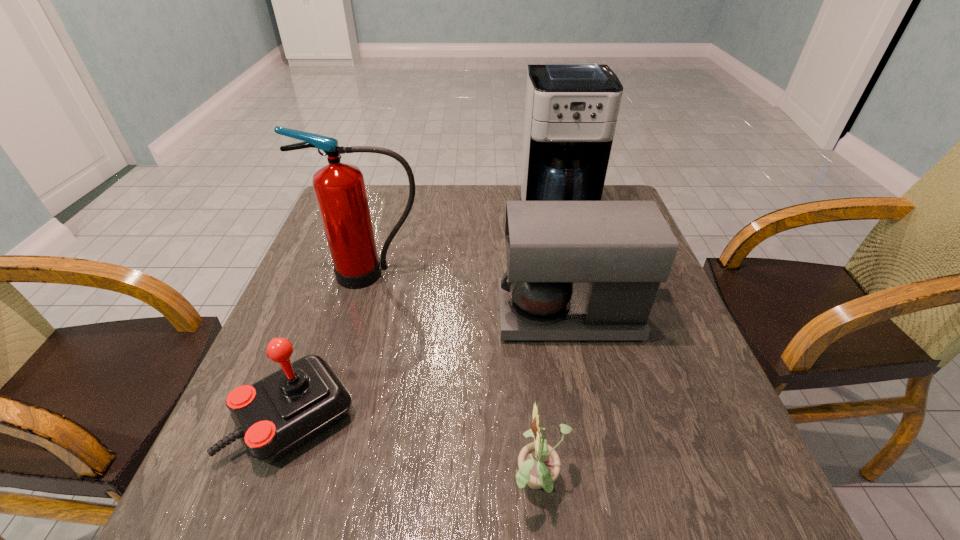
Where is `the farthest object`? the farthest object is located at coordinates (571, 108).

Where is `the farther coffee maker`? This screenshot has width=960, height=540. the farther coffee maker is located at coordinates (571, 108).

At what (x,y) coordinates should I click in order to perform the action: click on the second farthest object. Please return your answer as a coordinate pair (x, y). Looking at the image, I should click on point(340,191).

The image size is (960, 540). Identify the location of the nearer coffee maker. (576, 270).

At what (x,y) coordinates should I click in order to perform the action: click on the shorter coffee maker. Please return your answer as a coordinate pair (x, y). Looking at the image, I should click on coord(576,270).

Where is `joystick`? Image resolution: width=960 pixels, height=540 pixels. joystick is located at coordinates (274, 416).

Image resolution: width=960 pixels, height=540 pixels. I want to click on sunflower, so click(x=539, y=465).

You are a GUI agent. You are given a task and a screenshot of the screen. Output one action in this format:
    pyautogui.click(x=<x>, y=<y>)
    Task: Click on the vacant space located 0.320m on the front panel of the farther coffee maker
    
    Given the screenshot: What is the action you would take?
    pyautogui.click(x=585, y=322)

Identify the location of free space located 0.180m on the front of the fire extinguisher. This screenshot has width=960, height=540. (351, 347).

Identify the location of vacant region located 0.390m on the carafe side of the shorter coffee maker. This screenshot has height=540, width=960. (328, 315).